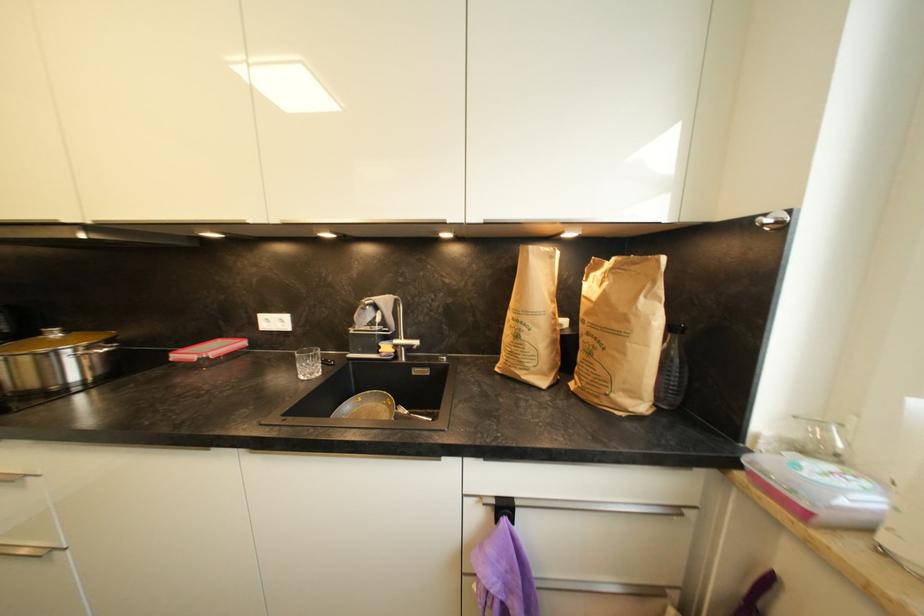
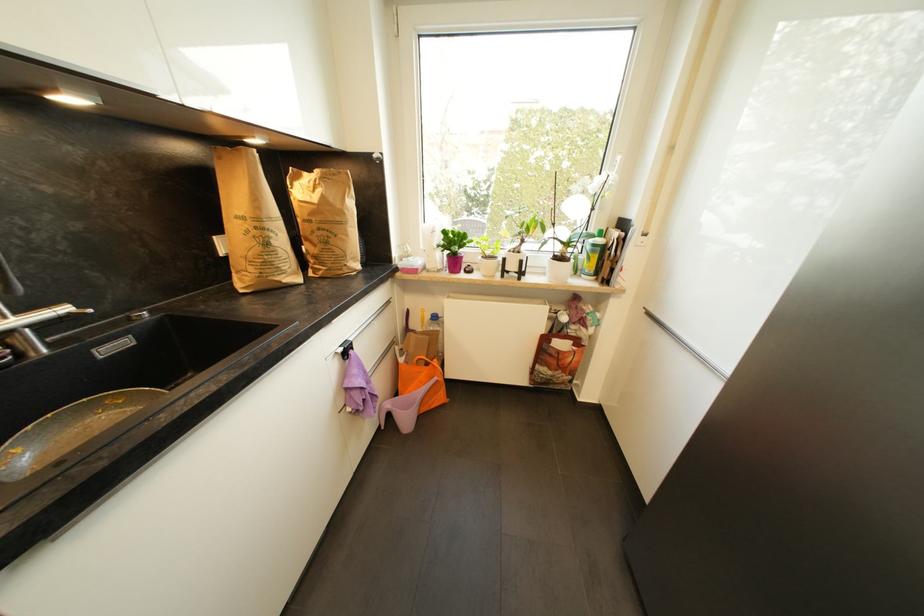
Where in the second image is the point corresponding to the point at 409,339 from the first image?

(27, 313)